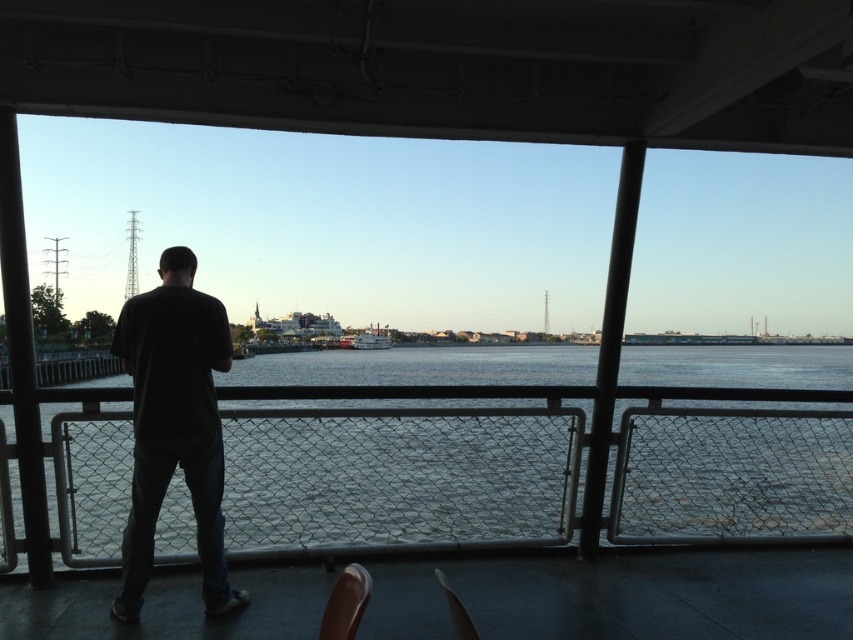
Does point (354, 595) come closer to viewer compared to point (466, 637)?

That is False.

Looking at this image, can you confirm if brown leather chair at lower center is taller than matte plastic chair at lower center?

Correct, brown leather chair at lower center is much taller as matte plastic chair at lower center.

Which is in front, point (352, 588) or point (474, 634)?

Point (474, 634) is more forward.

What are the coordinates of `brown leather chair at lower center` in the screenshot? It's located at (345, 604).

Is point (462, 636) farther from viewer compared to point (361, 333)?

No, (462, 636) is closer to viewer.

Is point (454, 627) closer to camera compared to point (378, 330)?

That is True.

This screenshot has width=853, height=640. Find the location of `matte plastic chair at lower center`. matte plastic chair at lower center is located at coordinates (456, 611).

Is dark matte shirt at center above matte plastic chair at lower center?

Yes, dark matte shirt at center is above matte plastic chair at lower center.

Is point (157, 465) farther from viewer compared to point (459, 609)?

Yes, point (157, 465) is behind point (459, 609).

Is point (202, 433) positioned before point (454, 609)?

No, (202, 433) is further to viewer.

Find the location of a particular element. The image size is (853, 640). dark matte shirt at center is located at coordinates (173, 426).